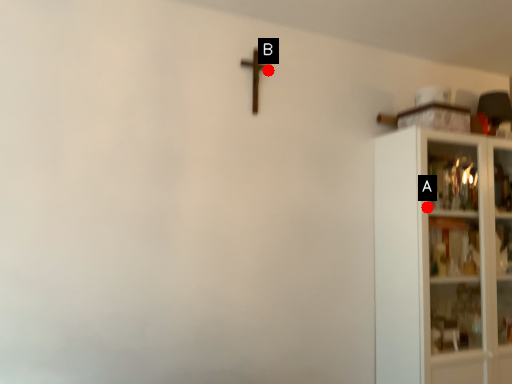
Question: Two points are circled on the image, labeled by A and B beside each circle. Which point appears closest to the camera in this image?

Choices:
 (A) A is closer
 (B) B is closer

Answer: (A)